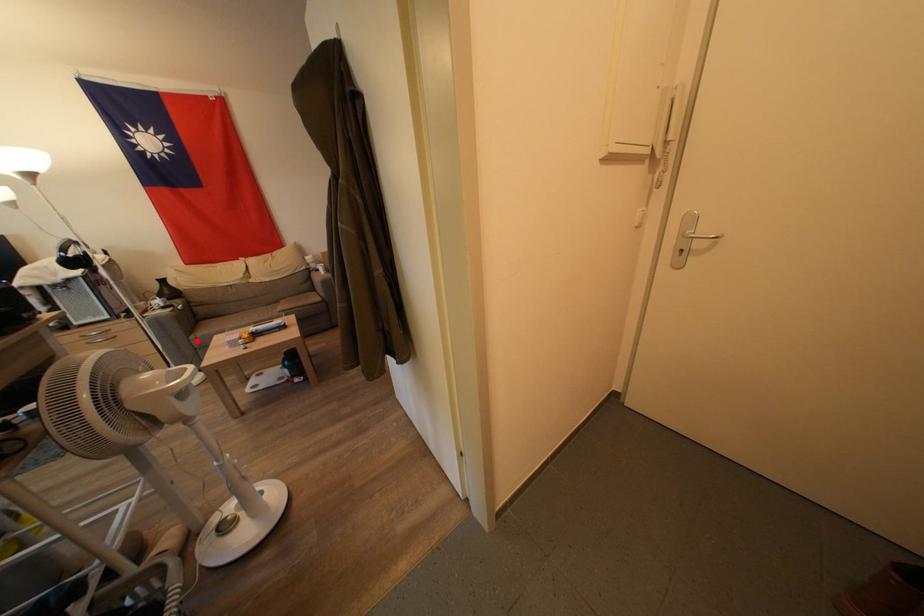
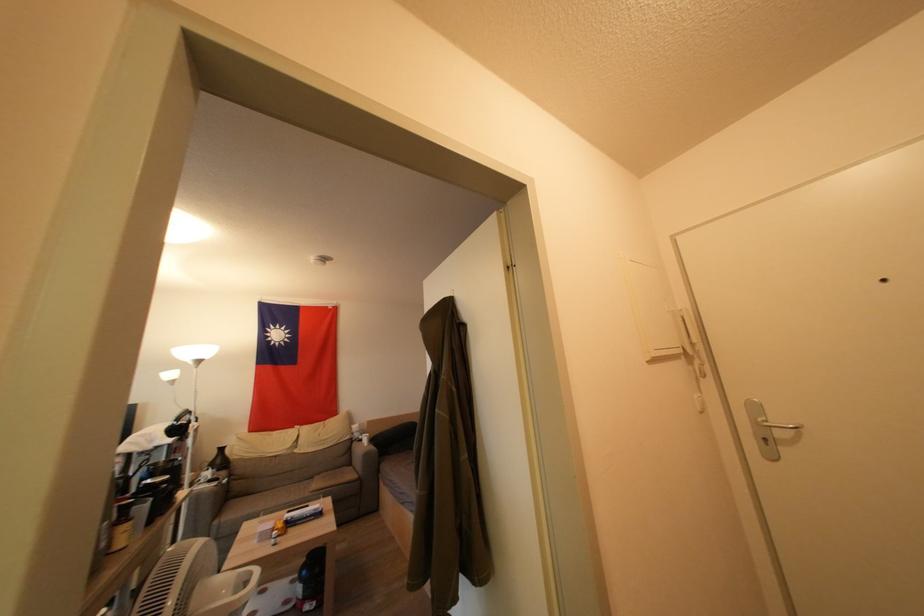
Where in the second image is the point corresponding to the highlighted location from the first image?

(221, 525)